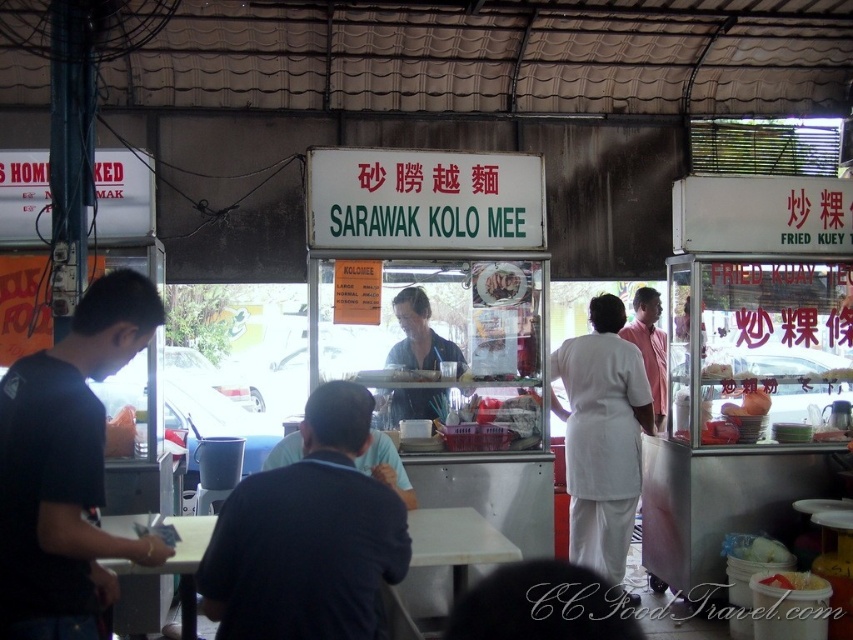
You are a customer at the Sarawak Kolo Mee stall and want to order a meal. You notice the metallic silver fried kuey teow cart at right and the pink cotton shirt at center. Which object is closer to you?

The metallic silver fried kuey teow cart at right is closer to you because it is in front of the pink cotton shirt at center.

You are a customer at the Sarawak Kolo Mee stall. You notice two staff members wearing shirts. One is wearing a dark blue shirt at center and the other a white fabric shirt at center. Which staff member is positioned closer to the left side of the stall?

The dark blue shirt at center is positioned to the left of the white fabric shirt at center, so the staff member in the dark blue shirt at center is closer to the left side of the stall.